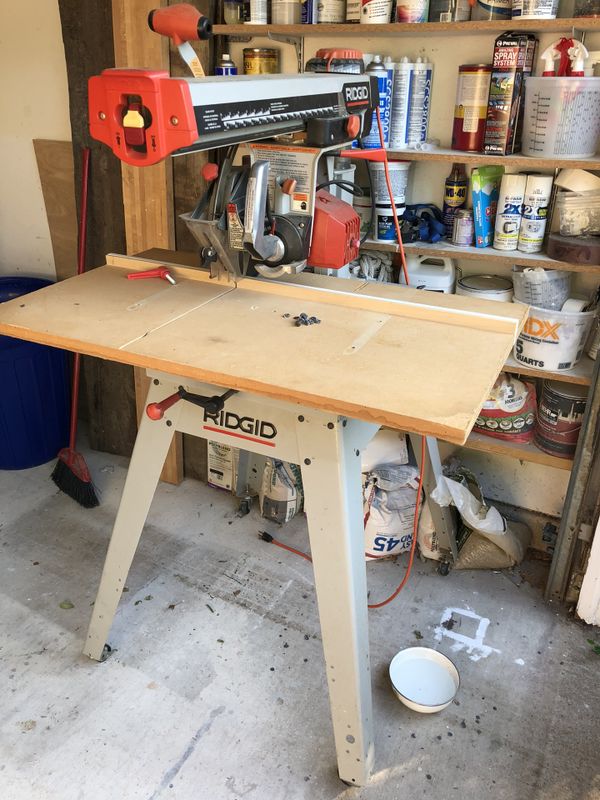
Where is `table`? Image resolution: width=600 pixels, height=800 pixels. table is located at coordinates (236, 313).